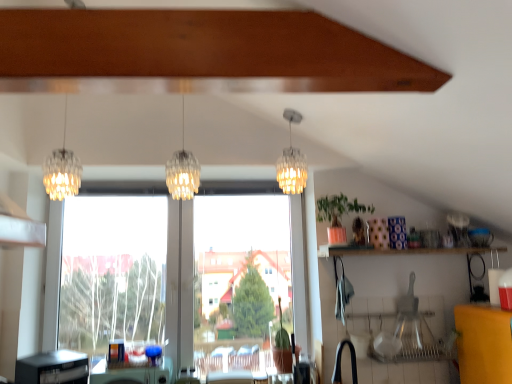
This screenshot has width=512, height=384. I want to click on vacant space situated above transparent glass window at center (from a real-world perspective), so click(200, 184).